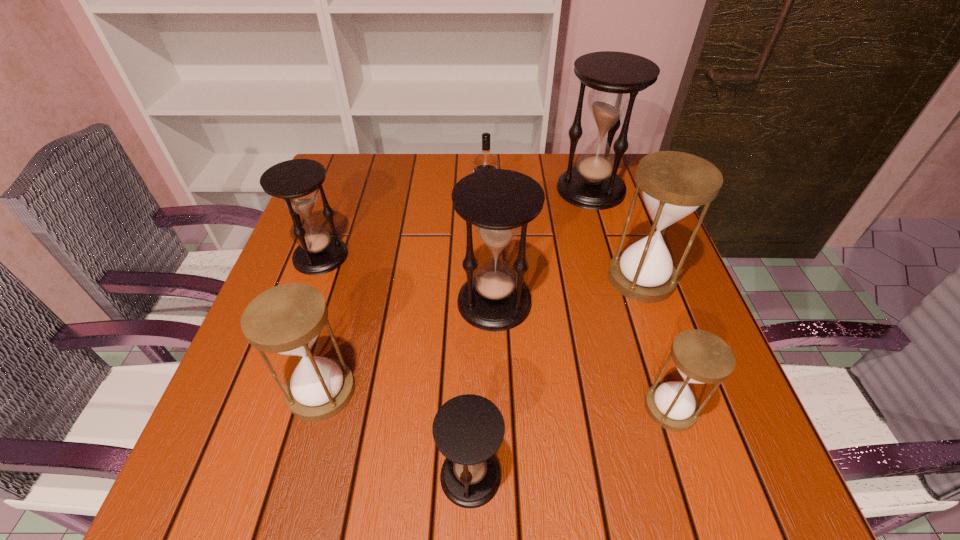
Find the location of a particular element. This screenshot has width=960, height=540. free space located on the front of the rightmost black hourglass is located at coordinates (628, 313).

This screenshot has width=960, height=540. I want to click on vacant space located on the front of the second biggest black hourglass, so click(x=496, y=372).

Locate an element on the screen. free space located on the left of the biggest white hourglass is located at coordinates (513, 278).

Where is `free location located on the label of the vodka`? free location located on the label of the vodka is located at coordinates (420, 214).

Image resolution: width=960 pixels, height=540 pixels. I want to click on vacant space located on the label of the vodka, so click(444, 214).

Locate an element on the screen. vacant point located on the label of the vodka is located at coordinates (358, 214).

Locate an element on the screen. vacant space situated on the right of the second smallest black hourglass is located at coordinates (456, 256).

Locate an element on the screen. This screenshot has width=960, height=540. blank area located on the back of the second smallest white hourglass is located at coordinates (338, 333).

Image resolution: width=960 pixels, height=540 pixels. I want to click on vacant point located 0.340m on the back of the smallest white hourglass, so click(x=621, y=254).

Find the location of a particular element. The width and height of the screenshot is (960, 540). blank area located 0.380m on the left of the nearest object is located at coordinates (191, 476).